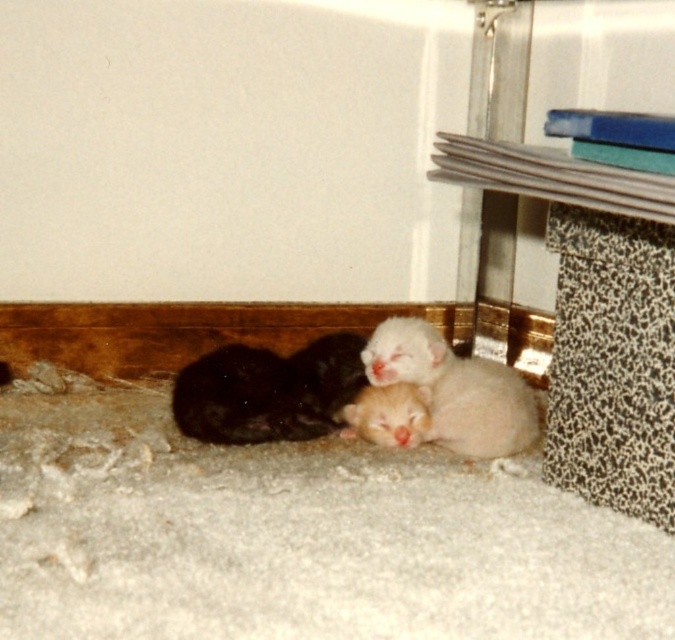
You are a photographer trying to capture a closeup shot of the soft fur kitten at lower left and the fluffy white kitten at lower center. Since you want to focus on both kittens equally, which one should you adjust your camera position to be closer to?

You should adjust your camera position to be closer to the soft fur kitten at lower left because it is located below the fluffy white kitten at lower center, so moving closer to it would help balance the focus between both kittens.

You are a photographer positioned at the center of the room. You want to capture a closeup shot of the soft fur kitten at lower left without moving any of the kittens. Can you estimate if the kitten is within your camera frame that has a field of view covering the area from coordinates 0.5 to 0.7 on the x and y axes?

The soft fur kitten at lower left is located at point (269, 392). Since the camera frame covers the x and y axes from 0.5 to 0.7, the kitten is within the frame as its coordinates fall within the specified range.